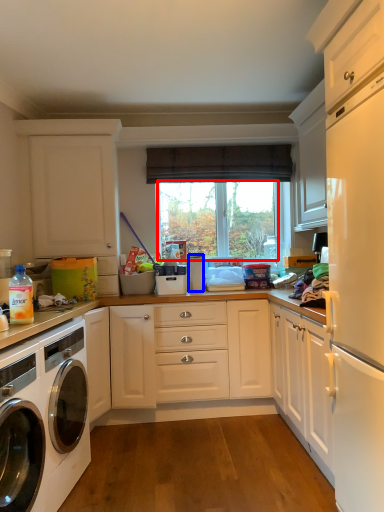
Question: Among these objects, which one is farthest to the camera, window screen (highlighted by a red box) or appliance (highlighted by a blue box)?

Choices:
 (A) window screen
 (B) appliance

Answer: (A)